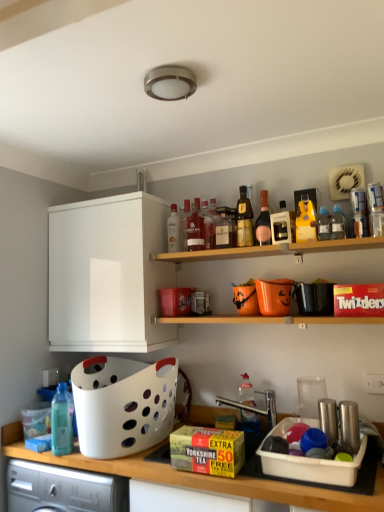
Question: Would you say matte glass bottle at upper center, the 3th bottle when ordered from left to right, is a long distance from shiny metallic cups at right, which appears as the 1th appliance when ordered from the bottom?

Choices:
 (A) no
 (B) yes

Answer: (B)

Question: Can you confirm if matte glass bottle at upper center, the 10th bottle when ordered from right to left, is wider than shiny metallic cups at right, which ranks as the second appliance in top-to-bottom order?

Choices:
 (A) yes
 (B) no

Answer: (B)

Question: Is matte glass bottle at upper center, the 10th bottle when ordered from right to left, next to shiny metallic cups at right, which ranks as the first appliance in front-to-back order, and touching it?

Choices:
 (A) no
 (B) yes

Answer: (A)

Question: Considering the relative sizes of matte glass bottle at upper center, the 10th bottle when ordered from right to left, and shiny metallic cups at right, which ranks as the second appliance in top-to-bottom order, in the image provided, is matte glass bottle at upper center, the 10th bottle when ordered from right to left, smaller than shiny metallic cups at right, which ranks as the second appliance in top-to-bottom order,?

Choices:
 (A) yes
 (B) no

Answer: (B)

Question: Does matte glass bottle at upper center, the 10th bottle when ordered from right to left, have a lesser width compared to shiny metallic cups at right, the 2th appliance in the back-to-front sequence?

Choices:
 (A) no
 (B) yes

Answer: (B)

Question: Is the depth of matte glass bottle at upper center, the 3th bottle when ordered from left to right, less than that of shiny metallic cups at right, which appears as the 1th appliance when ordered from the bottom?

Choices:
 (A) yes
 (B) no

Answer: (B)

Question: From a real-world perspective, is translucent plastic bottle at center, the eighth bottle positioned from the left, physically above shiny gold bottle at center, positioned as the 7th bottle in left-to-right order?

Choices:
 (A) no
 (B) yes

Answer: (A)

Question: Is translucent plastic bottle at center, the eighth bottle positioned from the left, thinner than shiny gold bottle at center, acting as the 6th bottle starting from the right?

Choices:
 (A) yes
 (B) no

Answer: (B)

Question: Are translucent plastic bottle at center, the eighth bottle positioned from the left, and shiny gold bottle at center, acting as the 6th bottle starting from the right, located far from each other?

Choices:
 (A) yes
 (B) no

Answer: (B)

Question: Considering the relative sizes of translucent plastic bottle at center, placed as the 5th bottle when sorted from right to left, and shiny gold bottle at center, acting as the 6th bottle starting from the right, in the image provided, is translucent plastic bottle at center, placed as the 5th bottle when sorted from right to left, shorter than shiny gold bottle at center, acting as the 6th bottle starting from the right,?

Choices:
 (A) no
 (B) yes

Answer: (B)

Question: Is translucent plastic bottle at center, the eighth bottle positioned from the left, looking in the opposite direction of shiny gold bottle at center, positioned as the 7th bottle in left-to-right order?

Choices:
 (A) yes
 (B) no

Answer: (B)

Question: Considering the relative sizes of translucent plastic bottle at center, the eighth bottle positioned from the left, and shiny gold bottle at center, positioned as the 7th bottle in left-to-right order, in the image provided, is translucent plastic bottle at center, the eighth bottle positioned from the left, taller than shiny gold bottle at center, positioned as the 7th bottle in left-to-right order,?

Choices:
 (A) no
 (B) yes

Answer: (A)

Question: From a real-world perspective, is transparent plastic bottle at lower left, which appears as the 1th bottle when viewed from the left, located higher than clear plastic bottle at upper right, which is the 11th bottle from left to right?

Choices:
 (A) yes
 (B) no

Answer: (B)